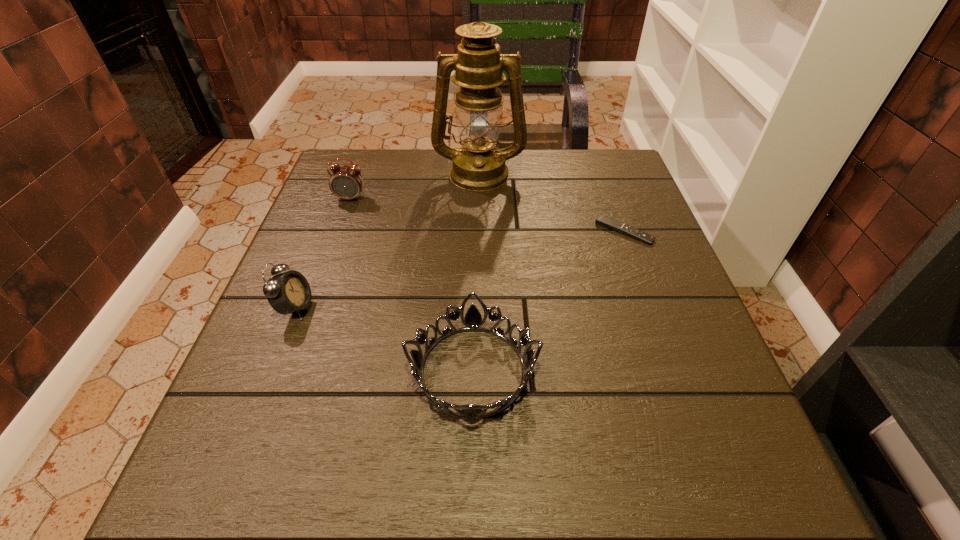
Locate an element on the screen. vacant space at the far right corner is located at coordinates (614, 148).

The width and height of the screenshot is (960, 540). I want to click on unoccupied area between the second farthest object and the oil lamp, so click(415, 186).

Identify the location of vacant space in between the farther alarm clock and the fourth tallest object. This screenshot has width=960, height=540. (412, 285).

At what (x,y) coordinates should I click in order to perform the action: click on vacant area between the nearer alarm clock and the shortest object. Please return your answer as a coordinate pair (x, y). Looking at the image, I should click on (460, 269).

You are a GUI agent. You are given a task and a screenshot of the screen. Output one action in this format:
    pyautogui.click(x=<x>, y=<y>)
    Task: Click on the free area in between the nearer alarm clock and the second shortest object
    
    Given the screenshot: What is the action you would take?
    pyautogui.click(x=384, y=339)

I want to click on vacant area that lies between the tiara and the farther alarm clock, so click(x=412, y=285).

I want to click on free space between the farther alarm clock and the third farthest object, so pyautogui.click(x=488, y=215).

This screenshot has width=960, height=540. I want to click on vacant area that lies between the fourth tallest object and the tallest object, so click(x=476, y=272).

Image resolution: width=960 pixels, height=540 pixels. Find the location of `vacant area that lies between the farthest object and the farther alarm clock`. vacant area that lies between the farthest object and the farther alarm clock is located at coordinates (415, 186).

Locate an element on the screen. The height and width of the screenshot is (540, 960). free spot between the nearer alarm clock and the farther alarm clock is located at coordinates [324, 253].